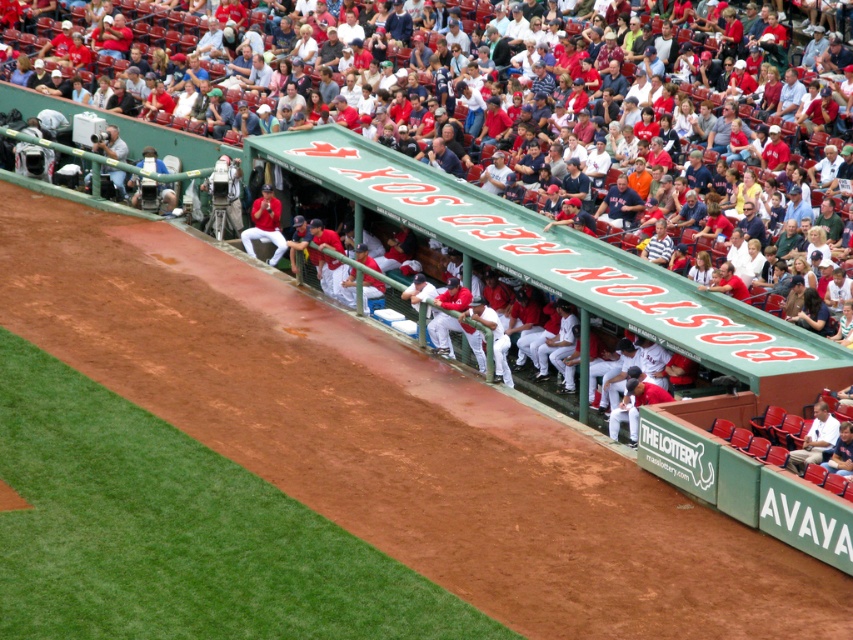
You are a photographer standing at the edge of the infield at Fenway Park. You want to take a photo that includes both the white plastic seats at upper center and the red uniformed players at center. Based on their positions, which object should appear to the left in your photo?

The white plastic seats at upper center should appear to the left of the red uniformed players at center in the photo because the white plastic seats at upper center is to the left of red uniformed players at center.

You are a photographer trying to capture a clear shot of the red uniformed players at center. However, there are white plastic seats at upper center blocking your view. Can you move the seats to get a better angle?

The white plastic seats at upper center are in front of the red uniformed players at center, so moving the seats would allow you to see the players clearly.